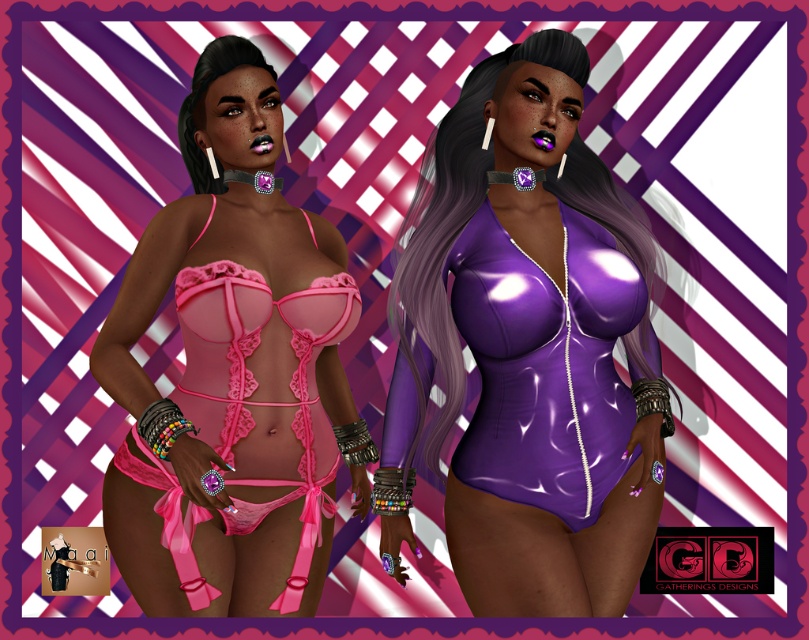
Which is below, matte purple bodysuit at center or matte pink lingerie at center?

Positioned lower is matte pink lingerie at center.

Can you confirm if matte purple bodysuit at center is wider than matte pink lingerie at center?

Yes.

Is point (433, 355) positioned after point (325, 412)?

That is False.

Where is `matte purple bodysuit at center`? This screenshot has height=640, width=809. matte purple bodysuit at center is located at coordinates (528, 348).

This screenshot has height=640, width=809. What are the coordinates of `matte purple bodysuit at center` in the screenshot? It's located at (528, 348).

Can you confirm if matte purple bodysuit at center is wider than matte pink lingerie at upper left?

Yes, matte purple bodysuit at center is wider than matte pink lingerie at upper left.

Where is `matte purple bodysuit at center`? This screenshot has height=640, width=809. matte purple bodysuit at center is located at coordinates (528, 348).

Where is `matte purple bodysuit at center`? This screenshot has width=809, height=640. matte purple bodysuit at center is located at coordinates (528, 348).

Can you confirm if matte purple bodysuit at center is positioned to the right of shiny purple bodysuit at right?

In fact, matte purple bodysuit at center is to the left of shiny purple bodysuit at right.

Is matte purple bodysuit at center smaller than shiny purple bodysuit at right?

Incorrect, matte purple bodysuit at center is not smaller in size than shiny purple bodysuit at right.

The image size is (809, 640). I want to click on matte purple bodysuit at center, so click(528, 348).

The image size is (809, 640). Identify the location of matte purple bodysuit at center. (528, 348).